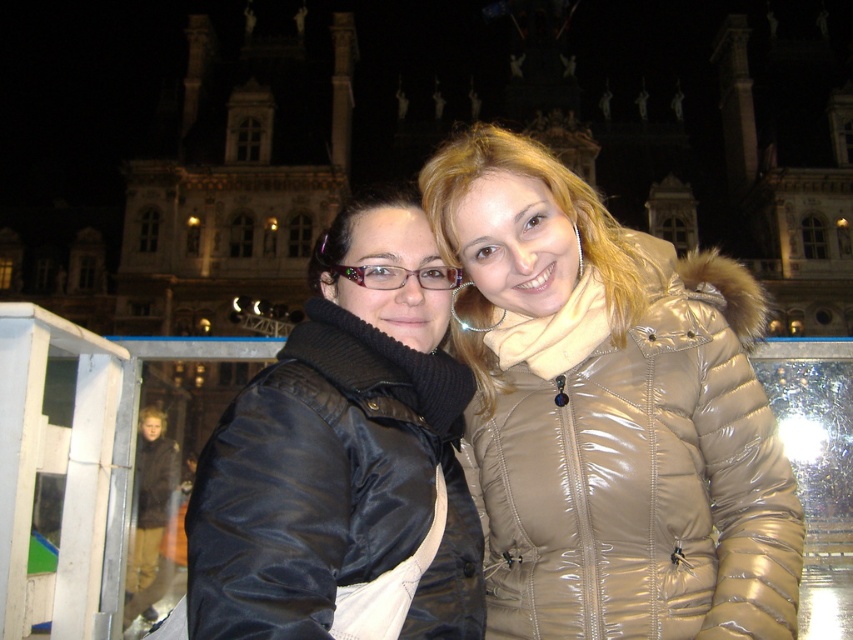
Question: Which of the following is the closest to the observer?

Choices:
 (A) (242, 445)
 (B) (616, 630)

Answer: (A)

Question: Which point is farther to the camera?

Choices:
 (A) black satin jacket at center
 (B) shiny beige coat at center

Answer: (B)

Question: Observing the image, what is the correct spatial positioning of shiny beige coat at center in reference to black satin jacket at center?

Choices:
 (A) right
 (B) left

Answer: (A)

Question: Does shiny beige coat at center have a lesser width compared to black satin jacket at center?

Choices:
 (A) yes
 (B) no

Answer: (B)

Question: Can you confirm if shiny beige coat at center is positioned below black satin jacket at center?

Choices:
 (A) no
 (B) yes

Answer: (A)

Question: Among these objects, which one is farthest from the camera?

Choices:
 (A) shiny beige coat at center
 (B) black satin jacket at center

Answer: (A)